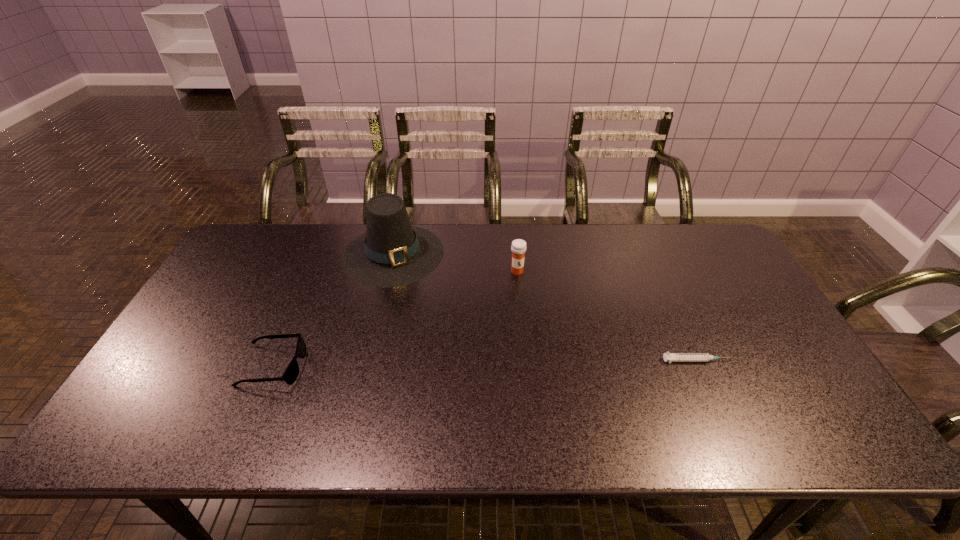
The height and width of the screenshot is (540, 960). I want to click on vacant space on the desktop that is between the sunglasses and the syringe and is positioned on the front-facing side of the hat, so click(423, 364).

The image size is (960, 540). In order to click on free space on the desktop that is between the sunglasses and the rightmost object and is positioned on the label side of the medicine in this screenshot , I will do `click(540, 363)`.